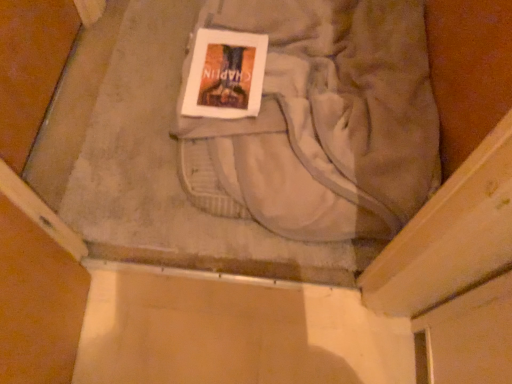
Question: Is light gray cotton sweat pants at center taller than hardcover book at center?

Choices:
 (A) yes
 (B) no

Answer: (A)

Question: Does light gray cotton sweat pants at center have a smaller size compared to hardcover book at center?

Choices:
 (A) yes
 (B) no

Answer: (B)

Question: Considering the relative sizes of light gray cotton sweat pants at center and hardcover book at center in the image provided, is light gray cotton sweat pants at center shorter than hardcover book at center?

Choices:
 (A) no
 (B) yes

Answer: (A)

Question: Is light gray cotton sweat pants at center closer to camera compared to hardcover book at center?

Choices:
 (A) no
 (B) yes

Answer: (B)

Question: Is the depth of light gray cotton sweat pants at center greater than that of hardcover book at center?

Choices:
 (A) no
 (B) yes

Answer: (A)

Question: Is hardcover book at center at the back of light gray cotton sweat pants at center?

Choices:
 (A) yes
 (B) no

Answer: (A)

Question: Considering the relative sizes of hardcover book at center and light gray cotton sweat pants at center in the image provided, is hardcover book at center bigger than light gray cotton sweat pants at center?

Choices:
 (A) no
 (B) yes

Answer: (A)

Question: Is hardcover book at center taller than light gray cotton sweat pants at center?

Choices:
 (A) no
 (B) yes

Answer: (A)

Question: Would you consider hardcover book at center to be distant from light gray cotton sweat pants at center?

Choices:
 (A) yes
 (B) no

Answer: (B)

Question: Is hardcover book at center aimed at light gray cotton sweat pants at center?

Choices:
 (A) no
 (B) yes

Answer: (B)

Question: Considering the relative positions of hardcover book at center and light gray cotton sweat pants at center in the image provided, is hardcover book at center behind light gray cotton sweat pants at center?

Choices:
 (A) no
 (B) yes

Answer: (B)

Question: Does hardcover book at center touch light gray cotton sweat pants at center?

Choices:
 (A) yes
 (B) no

Answer: (B)

Question: Considering the relative positions of light gray cotton sweat pants at center and hardcover book at center in the image provided, is light gray cotton sweat pants at center to the left or to the right of hardcover book at center?

Choices:
 (A) left
 (B) right

Answer: (B)